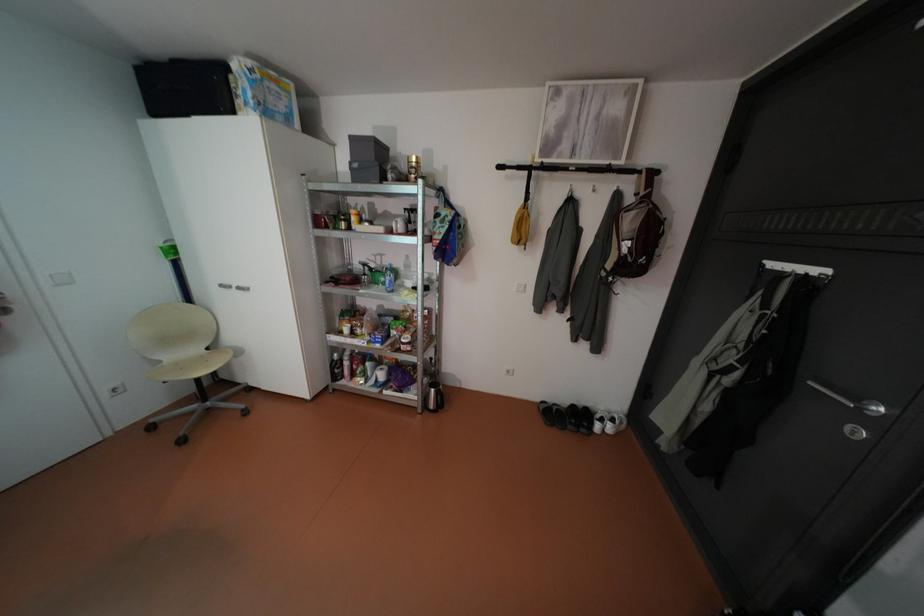
I want to click on blue cardboard box, so click(x=262, y=92).